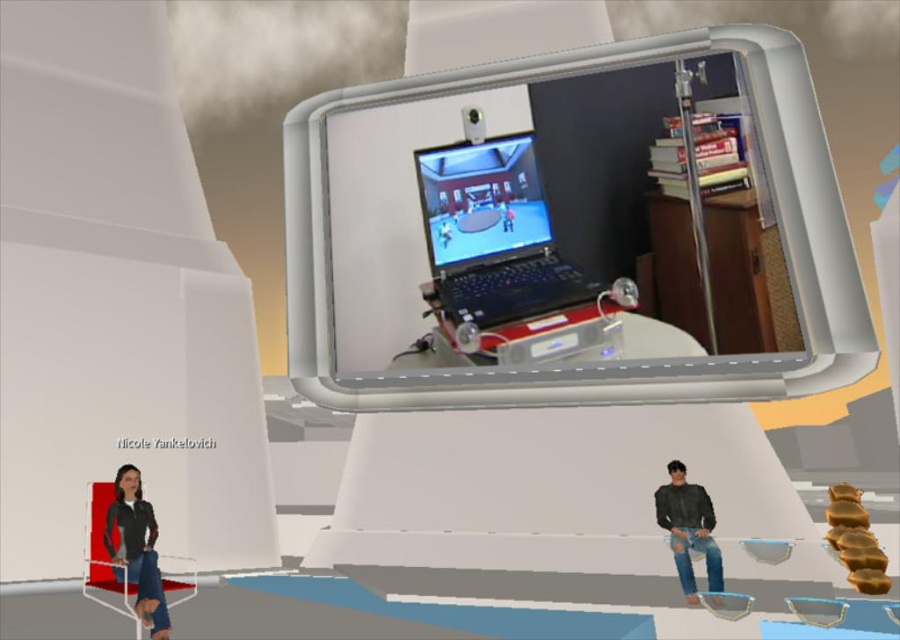
Question: Does black plastic laptop at center appear on the left side of dark gray fabric jacket at lower left?

Choices:
 (A) no
 (B) yes

Answer: (A)

Question: Which of these objects is positioned closest to the ripped denim jeans at lower right?

Choices:
 (A) dark gray fabric jacket at lower left
 (B) black plastic laptop at center

Answer: (A)

Question: Is black plastic laptop at center above dark gray fabric jacket at lower left?

Choices:
 (A) yes
 (B) no

Answer: (A)

Question: Based on their relative distances, which object is nearer to the ripped denim jeans at lower right?

Choices:
 (A) black plastic laptop at center
 (B) dark gray fabric jacket at lower left

Answer: (B)

Question: Which point appears farthest from the camera in this image?

Choices:
 (A) (684, 516)
 (B) (126, 572)

Answer: (A)

Question: Where is dark gray fabric jacket at lower left located in relation to ripped denim jeans at lower right in the image?

Choices:
 (A) above
 (B) below

Answer: (A)